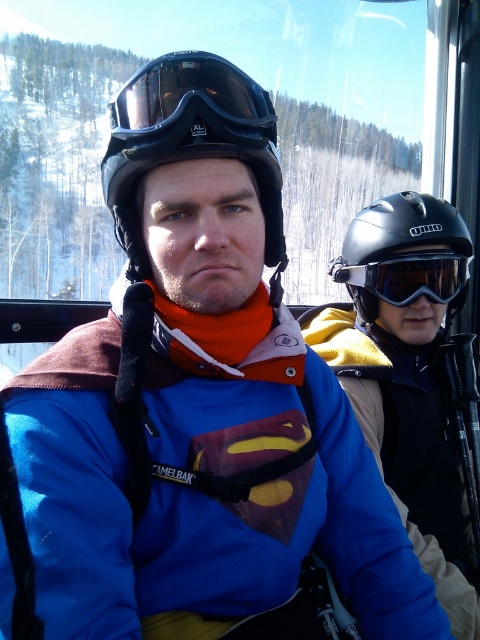
Question: Can you confirm if black matte ski goggles at upper center is positioned to the left of black matte goggles at center?

Choices:
 (A) yes
 (B) no

Answer: (A)

Question: Which point is farther from the camera taking this photo?

Choices:
 (A) (266, 138)
 (B) (444, 291)
 (C) (203, 144)
 (D) (436, 250)

Answer: (B)

Question: Considering the relative positions of black matte helmet at right and black matte ski goggles at upper center in the image provided, where is black matte helmet at right located with respect to black matte ski goggles at upper center?

Choices:
 (A) left
 (B) right

Answer: (B)

Question: Which of the following is the closest to the observer?

Choices:
 (A) (350, 227)
 (B) (230, 84)
 (C) (397, 262)

Answer: (B)

Question: Can you confirm if black matte helmet at right is positioned above black matte goggles at center?

Choices:
 (A) no
 (B) yes

Answer: (B)

Question: Which object is the closest to the matte black helmet at center?

Choices:
 (A) black matte helmet at right
 (B) black matte ski goggles at upper center
 (C) black matte goggles at center

Answer: (B)